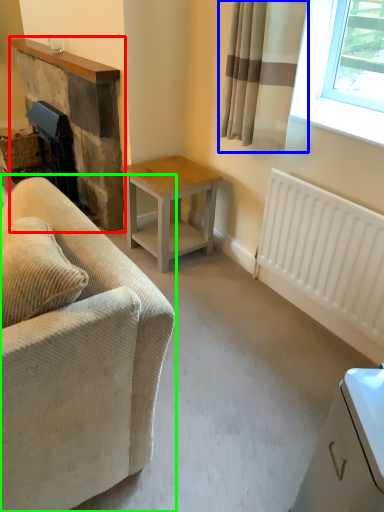
Question: Based on their relative distances, which object is nearer to fireplace (highlighted by a red box)? Choose from curtain (highlighted by a blue box) and studio couch (highlighted by a green box).

Choices:
 (A) curtain
 (B) studio couch

Answer: (A)